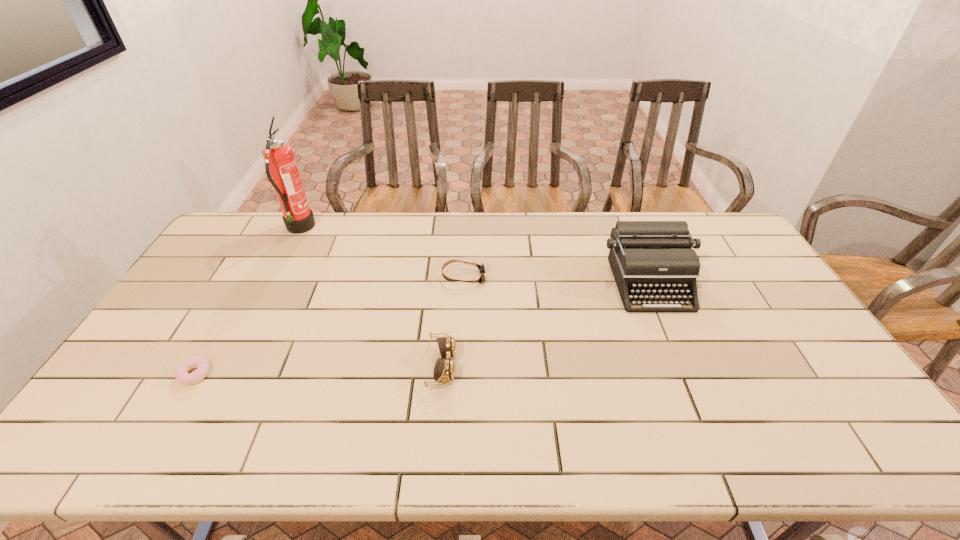
Locate an element on the screen. The image size is (960, 540). vacant region located on the typing side of the typewriter is located at coordinates (681, 355).

I want to click on vacant space located 0.340m through the lenses of the taller goggles, so click(x=583, y=366).

Find the location of a particular element. This screenshot has height=540, width=960. vacant position located on the front-facing side of the fourth tallest object is located at coordinates (516, 276).

The width and height of the screenshot is (960, 540). In order to click on vacant area situated on the right of the doughnut in this screenshot , I will do `click(313, 374)`.

The width and height of the screenshot is (960, 540). What are the coordinates of `object that is at the far edge` in the screenshot? It's located at 281,168.

You are a GUI agent. You are given a task and a screenshot of the screen. Output one action in this format:
    pyautogui.click(x=<x>, y=<y>)
    Task: Click on the object that is positioned at the left edge
    Image resolution: width=960 pixels, height=540 pixels.
    Given the screenshot: What is the action you would take?
    pyautogui.click(x=201, y=363)

You are a GUI agent. You are given a task and a screenshot of the screen. Output one action in this format:
    pyautogui.click(x=<x>, y=<y>)
    Task: Click on the vacant space at the far edge
    This screenshot has width=960, height=540.
    Given the screenshot: What is the action you would take?
    pyautogui.click(x=426, y=225)

Find the location of a particular element. The image size is (960, 540). free space at the near edge is located at coordinates (376, 442).

In the image, there is a desktop. At what (x,y) coordinates should I click in order to perform the action: click on free space at the far right corner. Please return your answer as a coordinate pair (x, y). Looking at the image, I should click on (725, 224).

This screenshot has height=540, width=960. Find the location of `vacant space that's between the taller goggles and the rightmost object`. vacant space that's between the taller goggles and the rightmost object is located at coordinates [546, 325].